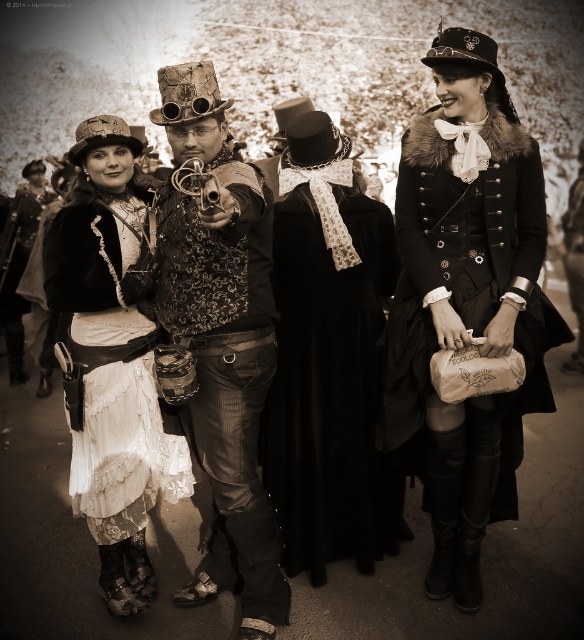
You are a photographer at the steampunk event. You want to take a photo focusing on the woman in the white dress with lace detailing and the person at the far right. Which of the two points, point A at coordinates point (208, 160) or point B at coordinates point (96, 394), is closer to the camera?

Point A at coordinates point (208, 160) is closer to the camera than point B at coordinates point (96, 394).

You are a photographer at the steampunk event. You want to take a photo of the steampunk attire at center and the white lace dress at center. Which one is positioned to the right side of the other?

The steampunk attire at center is to the right of the white lace dress at center.